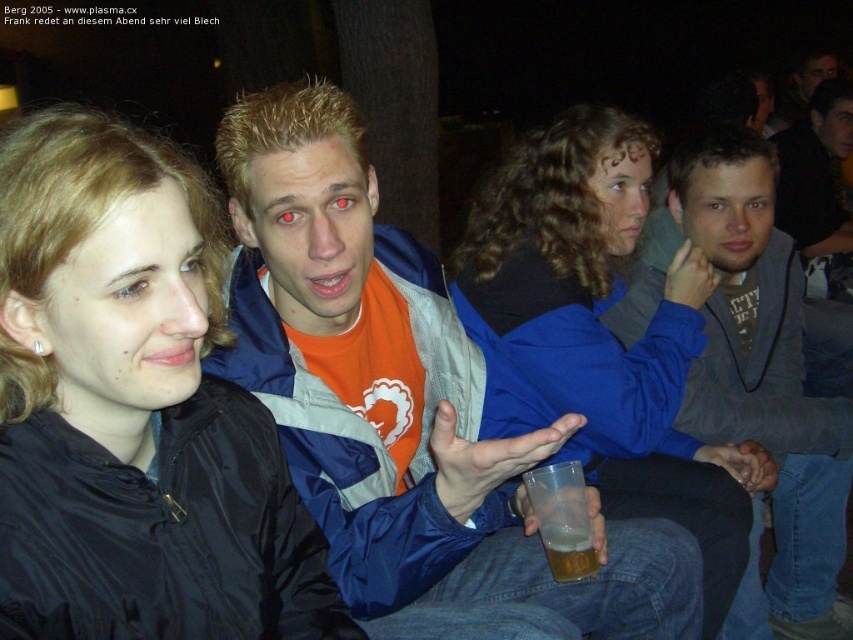
Who is taller, gray fleece jacket at center or translucent plastic cup at lower center?

Standing taller between the two is gray fleece jacket at center.

Who is lower down, gray fleece jacket at center or translucent plastic cup at lower center?

translucent plastic cup at lower center is below.

Find the location of a particular element. The width and height of the screenshot is (853, 640). gray fleece jacket at center is located at coordinates (763, 385).

Looking at this image, is black matte jacket at center bigger than gray fleece jacket at center?

Incorrect, black matte jacket at center is not larger than gray fleece jacket at center.

What do you see at coordinates (132, 410) in the screenshot? The image size is (853, 640). I see `black matte jacket at center` at bounding box center [132, 410].

Image resolution: width=853 pixels, height=640 pixels. In order to click on black matte jacket at center in this screenshot , I will do `click(132, 410)`.

Between blue fabric jacket at center and gray fleece jacket at center, which one has less height?

Standing shorter between the two is blue fabric jacket at center.

Measure the distance between point [587,138] and camera.

1.74 meters

The height and width of the screenshot is (640, 853). Identify the location of blue fabric jacket at center. (605, 332).